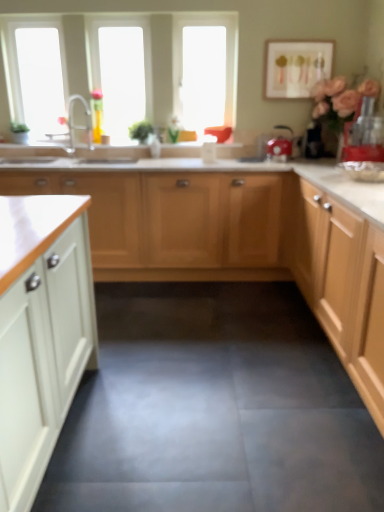
Question: From the image's perspective, is transparent plastic window screen at upper center, the second window screen viewed from the left, on red plastic blender at right, which appears as the 2th appliance when viewed from the left?

Choices:
 (A) yes
 (B) no

Answer: (A)

Question: Can you confirm if transparent plastic window screen at upper center, the 1th window screen positioned from the right, is positioned to the right of red plastic blender at right, which appears as the 1th appliance when viewed from the right?

Choices:
 (A) yes
 (B) no

Answer: (B)

Question: Can you confirm if transparent plastic window screen at upper center, the 1th window screen positioned from the right, is shorter than red plastic blender at right, which appears as the first appliance when viewed from the front?

Choices:
 (A) no
 (B) yes

Answer: (A)

Question: Could you tell me if transparent plastic window screen at upper center, the second window screen viewed from the left, is turned towards red plastic blender at right, which appears as the 1th appliance when viewed from the right?

Choices:
 (A) yes
 (B) no

Answer: (B)

Question: Considering the relative positions of transparent plastic window screen at upper center, the 1th window screen positioned from the right, and red plastic blender at right, which appears as the 2th appliance when viewed from the left, in the image provided, is transparent plastic window screen at upper center, the 1th window screen positioned from the right, to the left of red plastic blender at right, which appears as the 2th appliance when viewed from the left, from the viewer's perspective?

Choices:
 (A) no
 (B) yes

Answer: (B)

Question: From a real-world perspective, relative to white wood cabinets at center, is transparent plastic window screen at upper center, the second window screen viewed from the left, vertically above or below?

Choices:
 (A) below
 (B) above

Answer: (B)

Question: In terms of height, does transparent plastic window screen at upper center, the second window screen viewed from the left, look taller or shorter compared to white wood cabinets at center?

Choices:
 (A) short
 (B) tall

Answer: (B)

Question: From the image's perspective, relative to white wood cabinets at center, is transparent plastic window screen at upper center, the 1th window screen positioned from the right, above or below?

Choices:
 (A) above
 (B) below

Answer: (A)

Question: Do you think transparent plastic window screen at upper center, the 1th window screen positioned from the right, is within white wood cabinets at center, or outside of it?

Choices:
 (A) inside
 (B) outside

Answer: (B)

Question: Is silver metallic faucet at upper left spatially inside transparent plastic window screen at upper center, the second window screen viewed from the left, or outside of it?

Choices:
 (A) inside
 (B) outside

Answer: (B)

Question: Is silver metallic faucet at upper left wider or thinner than transparent plastic window screen at upper center, the second window screen viewed from the left?

Choices:
 (A) wide
 (B) thin

Answer: (A)

Question: Considering the positions of silver metallic faucet at upper left and transparent plastic window screen at upper center, the second window screen viewed from the left, in the image, is silver metallic faucet at upper left bigger or smaller than transparent plastic window screen at upper center, the second window screen viewed from the left,?

Choices:
 (A) small
 (B) big

Answer: (A)

Question: Is point (71, 111) positioned closer to the camera than point (220, 92)?

Choices:
 (A) closer
 (B) farther

Answer: (A)

Question: In terms of width, does matte white picture frame at upper right look wider or thinner when compared to red plastic blender at right, which appears as the 1th appliance when viewed from the right?

Choices:
 (A) thin
 (B) wide

Answer: (A)

Question: From a real-world perspective, is matte white picture frame at upper right positioned above or below red plastic blender at right, which appears as the 1th appliance when viewed from the right?

Choices:
 (A) above
 (B) below

Answer: (A)